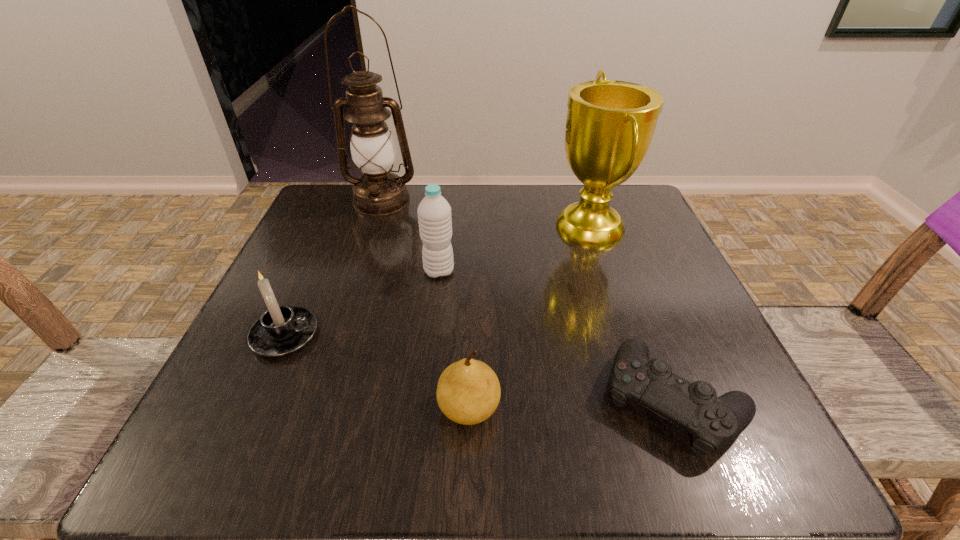
Locate an element on the screen. The width and height of the screenshot is (960, 540). vacant space that satisfies the following two spatial constraints: 1. on the shiny surface of the shortest object; 2. on the right side of the award is located at coordinates [647, 400].

Locate an element on the screen. The height and width of the screenshot is (540, 960). vacant space that satisfies the following two spatial constraints: 1. on the shiny surface of the control; 2. on the right side of the fifth shortest object is located at coordinates (647, 400).

Identify the location of vacant region that satisfies the following two spatial constraints: 1. on the back side of the pear; 2. on the left side of the control. (469, 400).

Locate an element on the screen. free space that satisfies the following two spatial constraints: 1. with a handle on the side of the candle holder; 2. on the left side of the pear is located at coordinates (253, 408).

Where is `vacant position in the image that satisfies the following two spatial constraints: 1. with a handle on the side of the candle holder; 2. on the right side of the pear`? The height and width of the screenshot is (540, 960). vacant position in the image that satisfies the following two spatial constraints: 1. with a handle on the side of the candle holder; 2. on the right side of the pear is located at coordinates (253, 408).

Where is `free location that satisfies the following two spatial constraints: 1. with a handle on the side of the pear; 2. on the right side of the candle holder`? Image resolution: width=960 pixels, height=540 pixels. free location that satisfies the following two spatial constraints: 1. with a handle on the side of the pear; 2. on the right side of the candle holder is located at coordinates (253, 408).

Locate an element on the screen. The height and width of the screenshot is (540, 960). vacant space that satisfies the following two spatial constraints: 1. on the shiny surface of the control; 2. on the left side of the second tallest object is located at coordinates (647, 400).